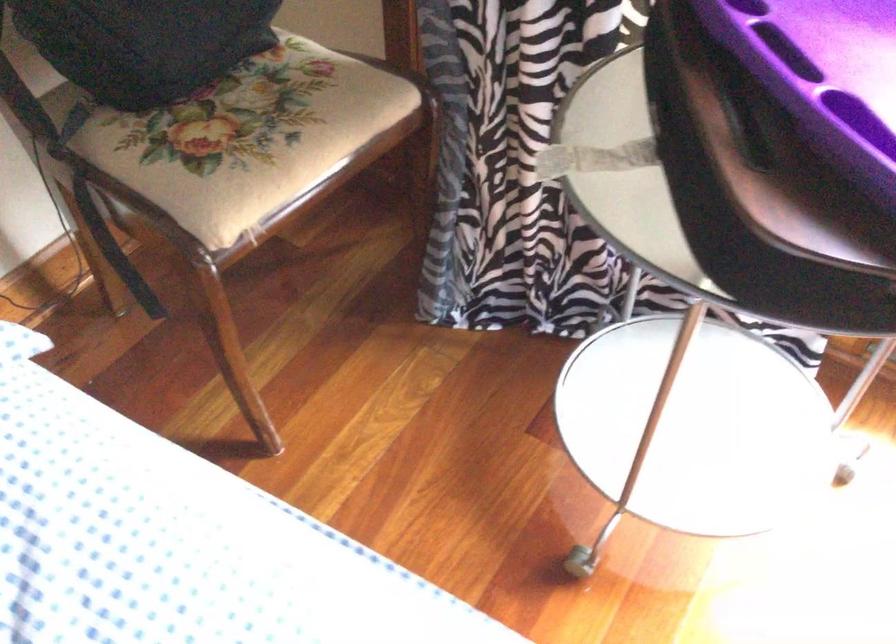
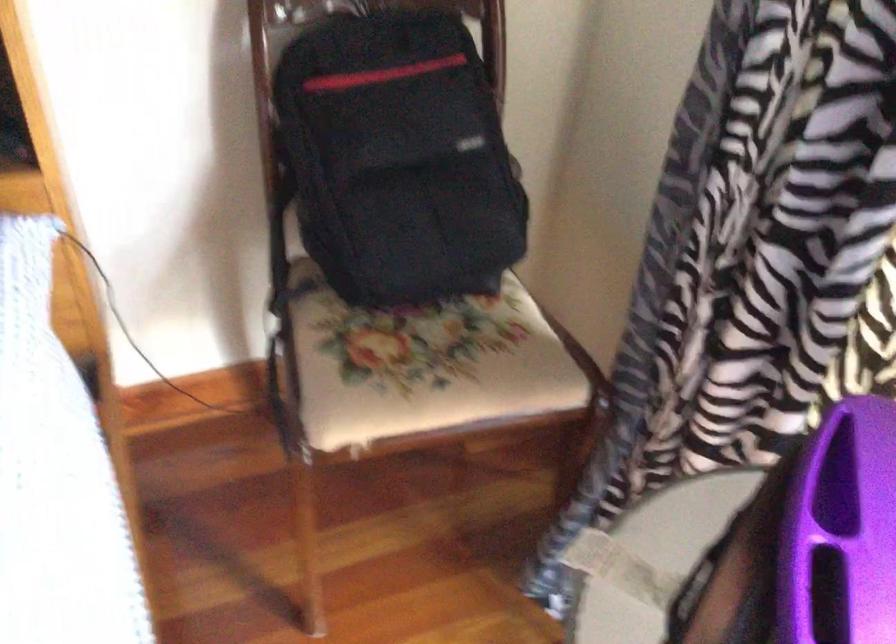
Question: The camera is either moving clockwise (left) or counter-clockwise (right) around the object. The first image is from the beginning of the video and the second image is from the end. Is the camera moving left or right when shooting the video?

Choices:
 (A) Left
 (B) Right

Answer: (B)